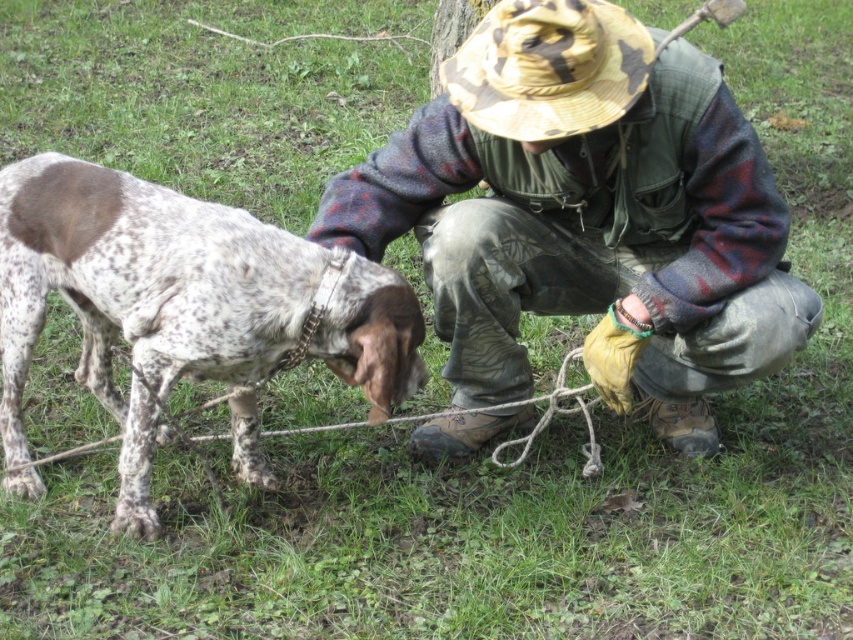
Who is higher up, camouflage hat at center or speckled fur dog at center?

camouflage hat at center is above.

Which is in front, point (523, 122) or point (315, 355)?

Point (523, 122)

Is point (656, 240) farther from viewer compared to point (180, 259)?

That is True.

Where is `camouflage hat at center`? Image resolution: width=853 pixels, height=640 pixels. camouflage hat at center is located at coordinates (587, 212).

Which is more to the left, camouflage hat at center or camouflage fabric hat at upper center?

camouflage fabric hat at upper center is more to the left.

Consider the image. Who is taller, camouflage hat at center or camouflage fabric hat at upper center?

camouflage hat at center is taller.

Who is more distant from viewer, (660, 212) or (521, 134)?

The point (660, 212) is behind.

At what (x,y) coordinates should I click in order to perform the action: click on camouflage hat at center. Please return your answer as a coordinate pair (x, y). Looking at the image, I should click on (587, 212).

Does speckled fur dog at center appear under camouflage fabric hat at upper center?

Indeed, speckled fur dog at center is positioned under camouflage fabric hat at upper center.

How far apart are speckled fur dog at center and camouflage fabric hat at upper center?

89.92 centimeters

Who is more forward, [24,192] or [605,96]?

Point [605,96] is more forward.

Locate an element on the screen. This screenshot has width=853, height=640. speckled fur dog at center is located at coordinates (183, 310).